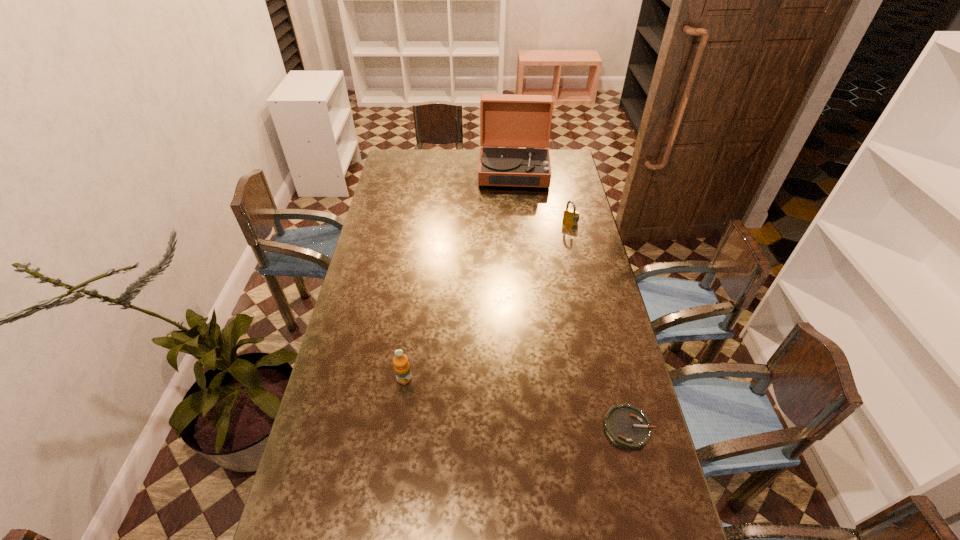
Locate an element on the screen. This screenshot has width=960, height=540. the third farthest object is located at coordinates (401, 365).

In order to click on orange juice in this screenshot , I will do 401,365.

Locate an element on the screen. the shortest object is located at coordinates (627, 426).

Locate an element on the screen. This screenshot has width=960, height=540. ashtray is located at coordinates (627, 426).

The height and width of the screenshot is (540, 960). I want to click on padlock, so [x=571, y=216].

Image resolution: width=960 pixels, height=540 pixels. What are the coordinates of `the second farthest object` in the screenshot? It's located at (571, 216).

At what (x,y) coordinates should I click in order to perform the action: click on phonograph record. Please return your answer as a coordinate pair (x, y). The height and width of the screenshot is (540, 960). Looking at the image, I should click on (524, 121).

Locate an element on the screen. The image size is (960, 540). the third object from right to left is located at coordinates (524, 121).

This screenshot has width=960, height=540. What are the coordinates of `vacant space located on the label of the orange juice` in the screenshot? It's located at (395, 447).

Where is `free space located 0.200m on the left of the shortest object`? The width and height of the screenshot is (960, 540). free space located 0.200m on the left of the shortest object is located at coordinates (533, 428).